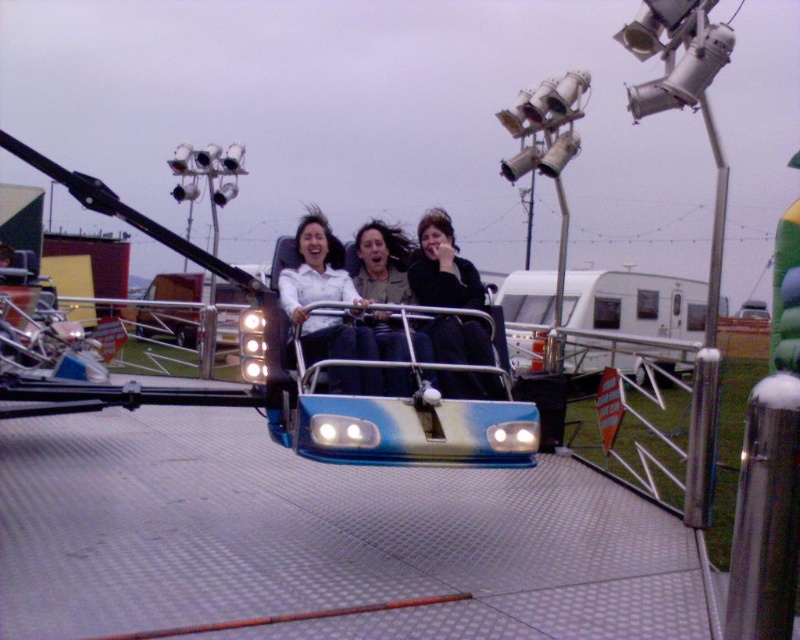
Question: Among these points, which one is farthest from the camera?

Choices:
 (A) (490, 328)
 (B) (392, 257)

Answer: (B)

Question: Is matte white shirt at center closer to the viewer compared to matte black jacket at center?

Choices:
 (A) no
 (B) yes

Answer: (B)

Question: Which object appears closest to the camera in this image?

Choices:
 (A) matte black jacket at center
 (B) matte white shirt at center

Answer: (B)

Question: Is black matte jacket at center below matte white shirt at center?

Choices:
 (A) yes
 (B) no

Answer: (A)

Question: Considering the real-world distances, which object is farthest from the matte white shirt at center?

Choices:
 (A) matte black jacket at center
 (B) black matte jacket at center

Answer: (B)

Question: Can you confirm if matte white shirt at center is positioned below matte black jacket at center?

Choices:
 (A) yes
 (B) no

Answer: (A)